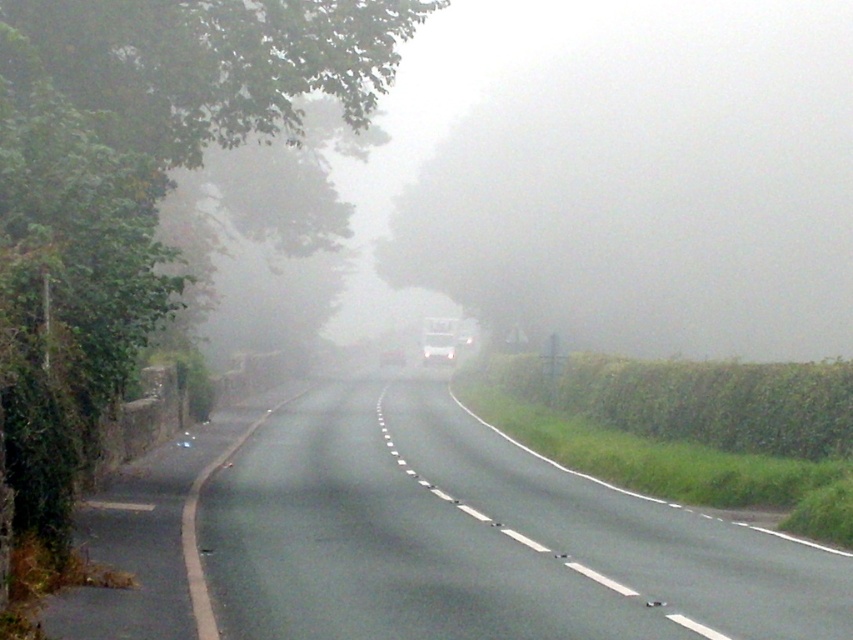
From the picture: Measure the distance from smooth asphalt road at center to black asphalt road at left.

The distance of smooth asphalt road at center from black asphalt road at left is 2.14 meters.

Which is above, smooth asphalt road at center or black asphalt road at left?

Positioned higher is black asphalt road at left.

Who is more distant from viewer, (538, 522) or (148, 509)?

Positioned behind is point (148, 509).

In order to click on smooth asphalt road at center in this screenshot , I will do `click(418, 538)`.